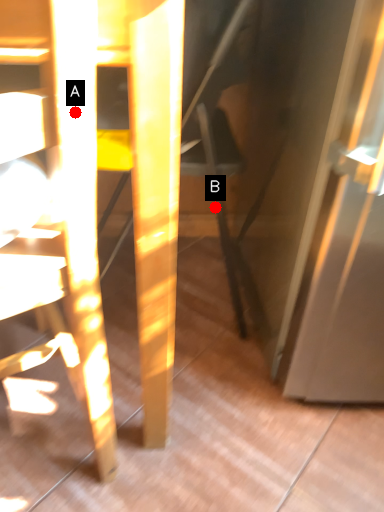
Question: Two points are circled on the image, labeled by A and B beside each circle. Which point is closer to the camera?

Choices:
 (A) A is closer
 (B) B is closer

Answer: (A)